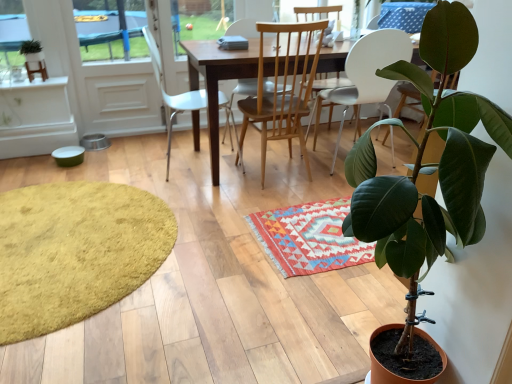
Locate an element on the screen. Image resolution: width=512 pixels, height=384 pixels. free region on the left part of light wood/wooden chair at center, acting as the 2th chair starting from the left is located at coordinates (217, 178).